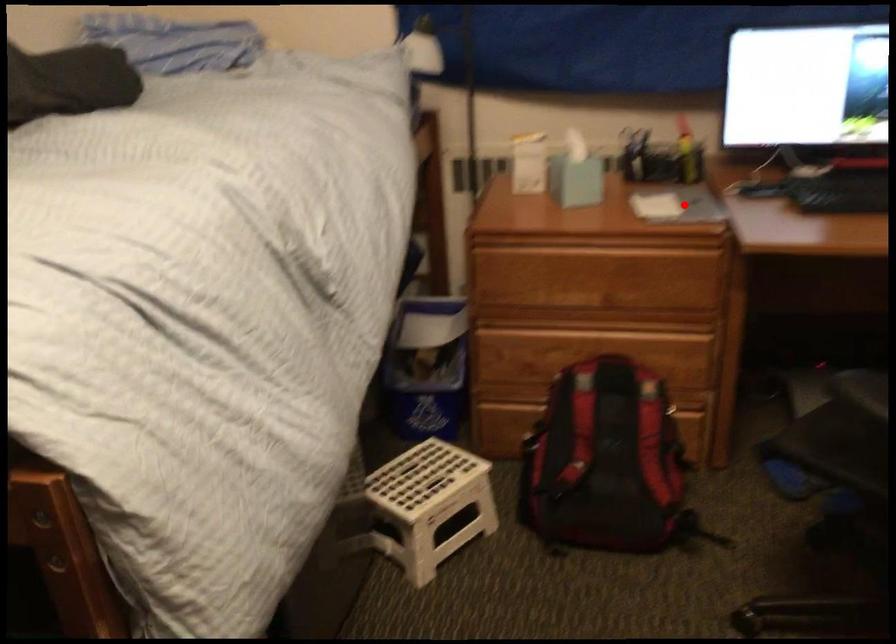
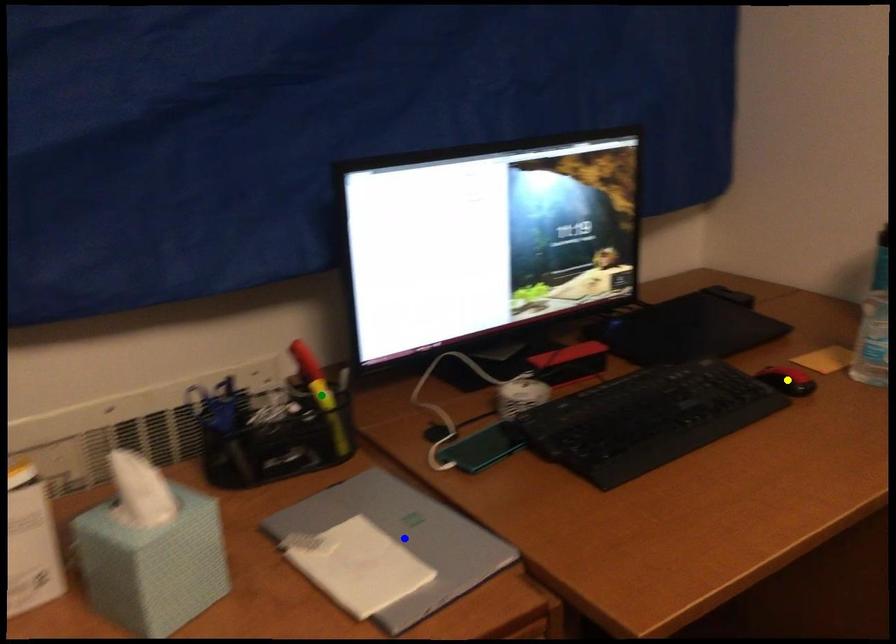
Question: I am providing you with two images of the same scene from different viewpoints. A red point is marked on the first image. You are given multiple points on the second image. Which mark in image 2 goes with the point in image 1?

Choices:
 (A) blue point
 (B) yellow point
 (C) green point

Answer: (A)